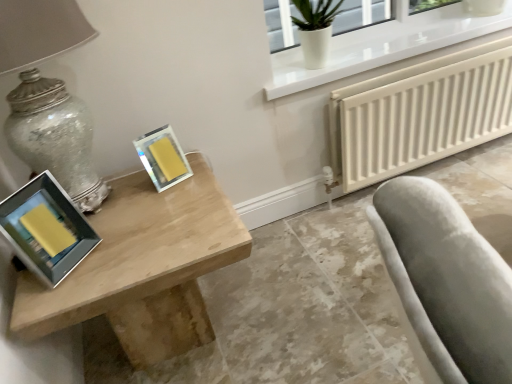
Question: From the image's perspective, does matte glass table lamp at left appear lower than light wood table at left?

Choices:
 (A) yes
 (B) no

Answer: (B)

Question: Would you consider matte glass table lamp at left to be distant from light wood table at left?

Choices:
 (A) no
 (B) yes

Answer: (A)

Question: Is matte glass table lamp at left facing away from light wood table at left?

Choices:
 (A) no
 (B) yes

Answer: (A)

Question: From the image's perspective, would you say matte glass table lamp at left is positioned over light wood table at left?

Choices:
 (A) yes
 (B) no

Answer: (A)

Question: Does matte glass table lamp at left appear on the right side of light wood table at left?

Choices:
 (A) no
 (B) yes

Answer: (A)

Question: Based on their positions, is yellow matte picture frame at upper center, which is counted as the 1th picture frame, starting from the right, located to the left or right of white glossy glass vase at upper right?

Choices:
 (A) right
 (B) left

Answer: (B)

Question: From the image's perspective, relative to white glossy glass vase at upper right, is yellow matte picture frame at upper center, which is the first picture frame from back to front, above or below?

Choices:
 (A) below
 (B) above

Answer: (A)

Question: From a real-world perspective, is yellow matte picture frame at upper center, which is counted as the 2th picture frame, starting from the front, above or below white glossy glass vase at upper right?

Choices:
 (A) above
 (B) below

Answer: (B)

Question: Considering the positions of point (156, 148) and point (332, 18), is point (156, 148) closer or farther from the camera than point (332, 18)?

Choices:
 (A) closer
 (B) farther

Answer: (A)

Question: In terms of size, does yellow matte picture frame at upper center, which is the first picture frame from back to front, appear bigger or smaller than matte yellow picture frame at left, the first picture frame from the left?

Choices:
 (A) big
 (B) small

Answer: (B)

Question: Is yellow matte picture frame at upper center, which is the second picture frame from left to right, situated inside matte yellow picture frame at left, which ranks as the 1th picture frame in front-to-back order, or outside?

Choices:
 (A) outside
 (B) inside

Answer: (A)

Question: From the image's perspective, relative to matte yellow picture frame at left, which ranks as the 1th picture frame in front-to-back order, is yellow matte picture frame at upper center, which is counted as the 1th picture frame, starting from the right, above or below?

Choices:
 (A) above
 (B) below

Answer: (A)

Question: Is point (159, 165) positioned closer to the camera than point (92, 248)?

Choices:
 (A) closer
 (B) farther

Answer: (B)

Question: Considering the relative positions of white textured radiator at lower right and white glossy glass vase at upper right in the image provided, is white textured radiator at lower right to the left or to the right of white glossy glass vase at upper right?

Choices:
 (A) right
 (B) left

Answer: (A)

Question: Looking at the image, does white textured radiator at lower right seem bigger or smaller compared to white glossy glass vase at upper right?

Choices:
 (A) small
 (B) big

Answer: (B)